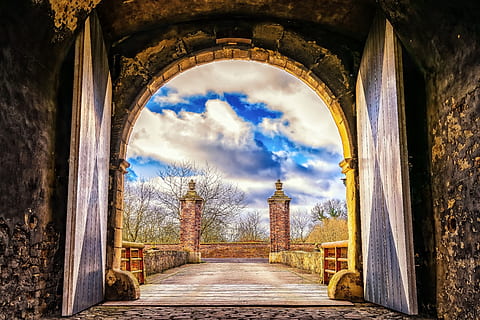
Identify the location of door handel. (410, 165).